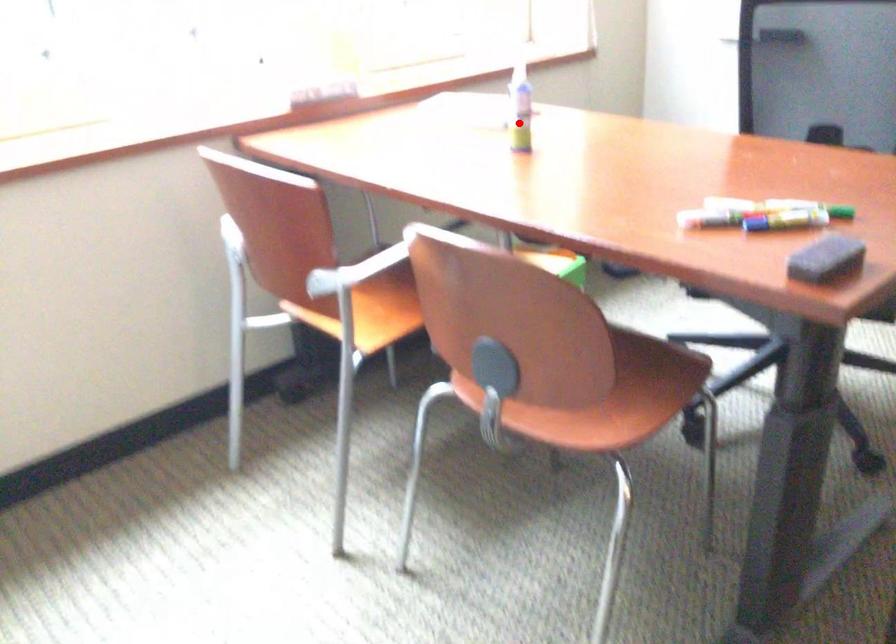
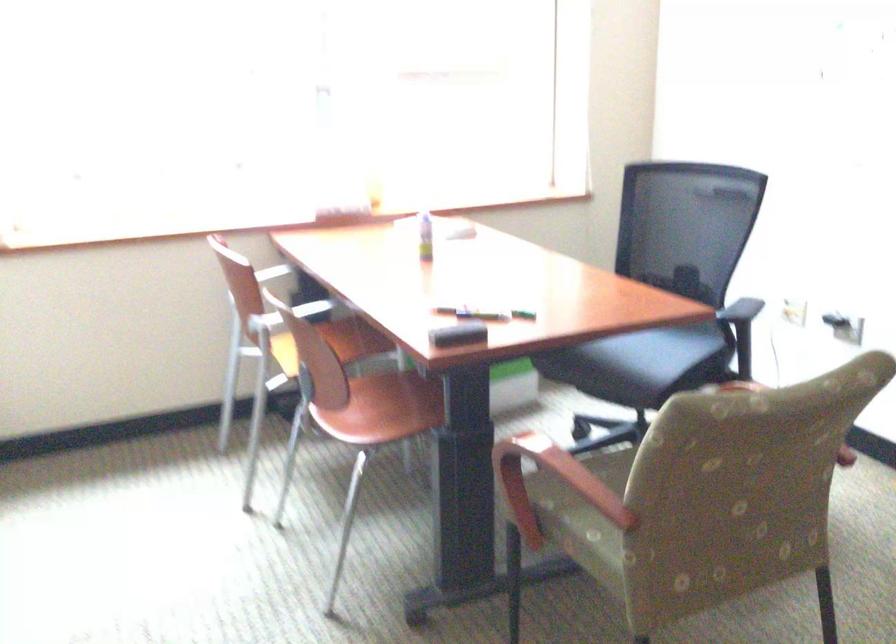
Locate, in the second image, the point that corresponds to the highlighted location in the first image.

(425, 236)